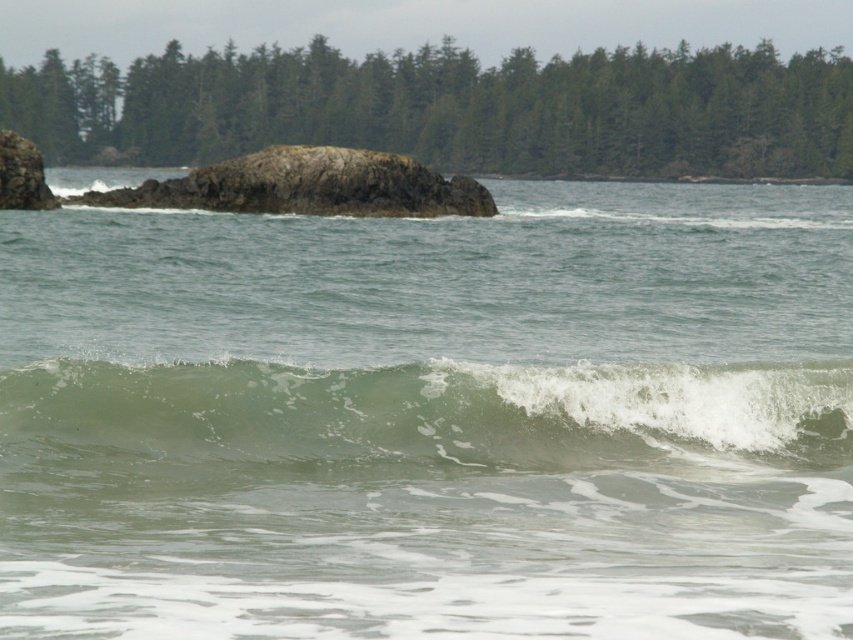
Question: Which of the following is the farthest from the observer?

Choices:
 (A) rough textured rock at center
 (B) green translucent water at center

Answer: (A)

Question: Does green translucent water at center have a larger size compared to rough textured rock at center?

Choices:
 (A) no
 (B) yes

Answer: (A)

Question: Which point is farther to the camera?

Choices:
 (A) (495, 316)
 (B) (773, 384)

Answer: (A)

Question: Which of the following is the closest to the observer?

Choices:
 (A) greenish water at wave center
 (B) green translucent water at center
 (C) rough textured rock at center

Answer: (A)

Question: Can you confirm if green translucent water at center is positioned below rough textured rock at center?

Choices:
 (A) yes
 (B) no

Answer: (A)

Question: From the image, what is the correct spatial relationship of greenish water at wave center in relation to rough textured rock at center?

Choices:
 (A) below
 (B) above

Answer: (A)